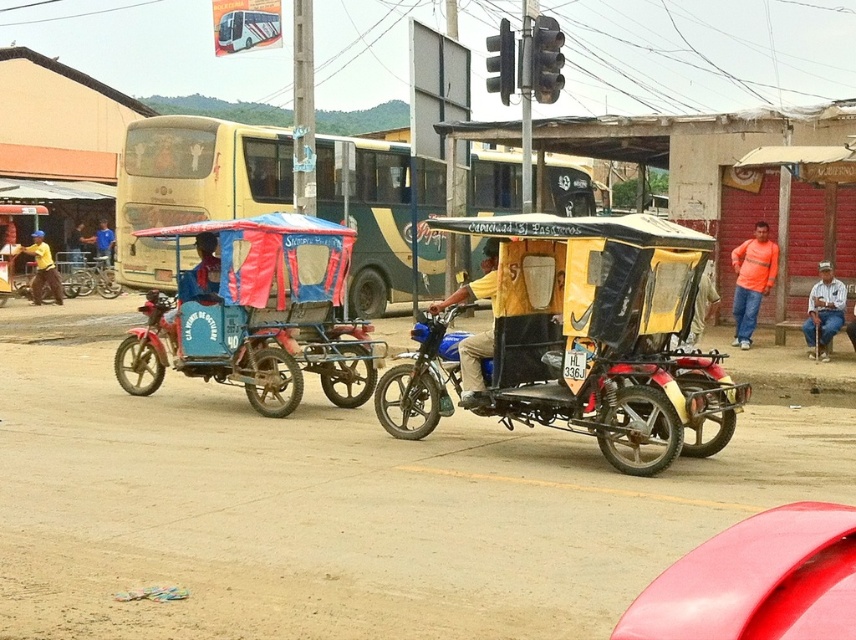
Question: Does yellow fabric at left have a lesser width compared to blue fabric umbrella at center?

Choices:
 (A) no
 (B) yes

Answer: (A)

Question: Can you confirm if glossy red car at lower right is smaller than blue fabric cart at center?

Choices:
 (A) yes
 (B) no

Answer: (A)

Question: Which point is farther to the camera?

Choices:
 (A) (111, 289)
 (B) (217, 291)

Answer: (A)

Question: Which is farther from the blue fabric cart at center?

Choices:
 (A) silver metallic bicycle at left
 (B) black plastic traffic light at upper center
 (C) yellow fabric at left
 (D) yellow matte rickshaw at center

Answer: (A)

Question: Does yellow matte rickshaw at center lie in front of blue fabric cart at center?

Choices:
 (A) yes
 (B) no

Answer: (A)

Question: Based on their relative distances, which object is nearer to the blue fabric cart at center?

Choices:
 (A) blue fabric umbrella at center
 (B) glossy red car at lower right
 (C) silver metallic bicycle at left
 (D) yellow matte bus at center

Answer: (D)